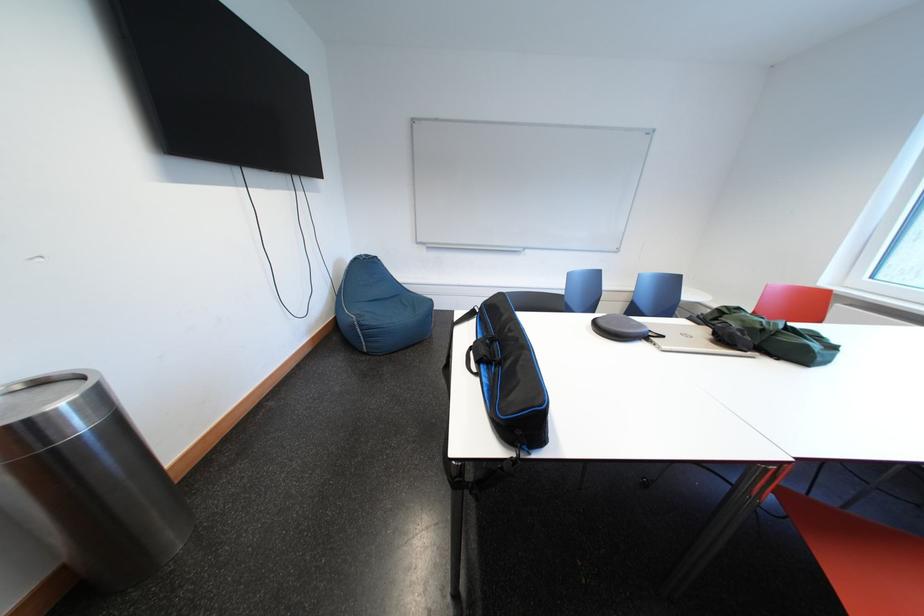
Identify the location of silver trash can lid. (51, 410).